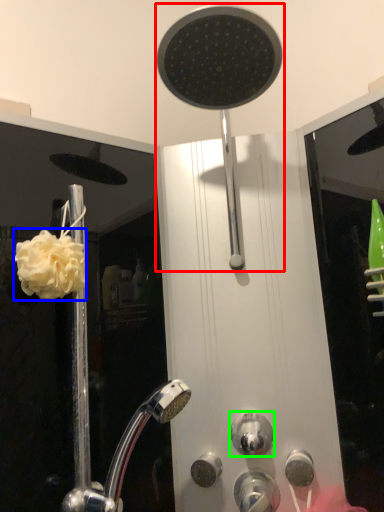
Question: Which object is positioned farthest from shower (highlighted by a red box)? Select from flower (highlighted by a blue box) and knob (highlighted by a green box).

Choices:
 (A) flower
 (B) knob

Answer: (B)